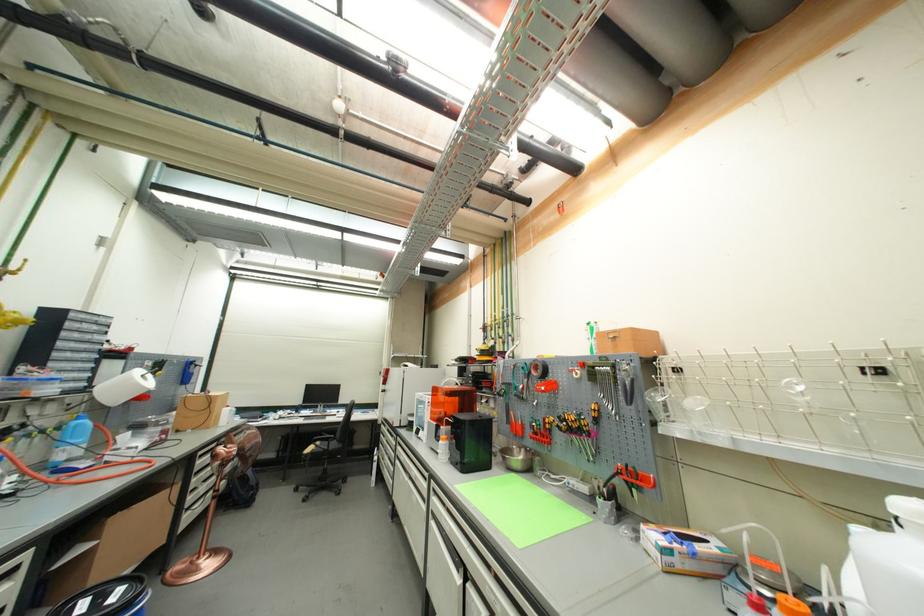
This screenshot has width=924, height=616. What are the coordinates of `white lamp head` in the screenshot? It's located at (281, 353).